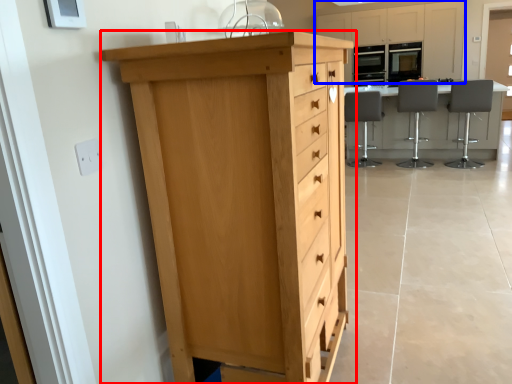
Question: Which object is closer to the camera taking this photo, chest of drawers (highlighted by a red box) or cabinetry (highlighted by a blue box)?

Choices:
 (A) chest of drawers
 (B) cabinetry

Answer: (A)